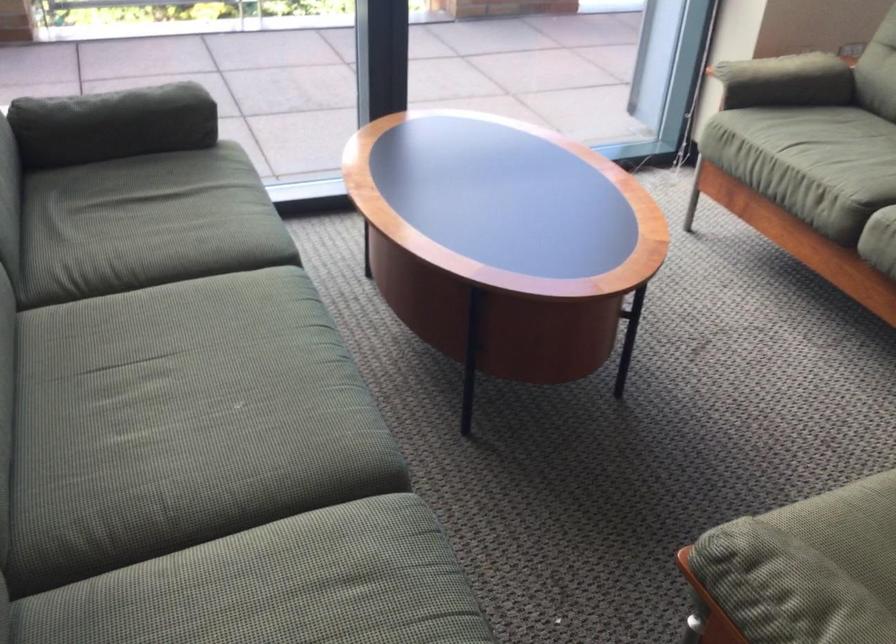
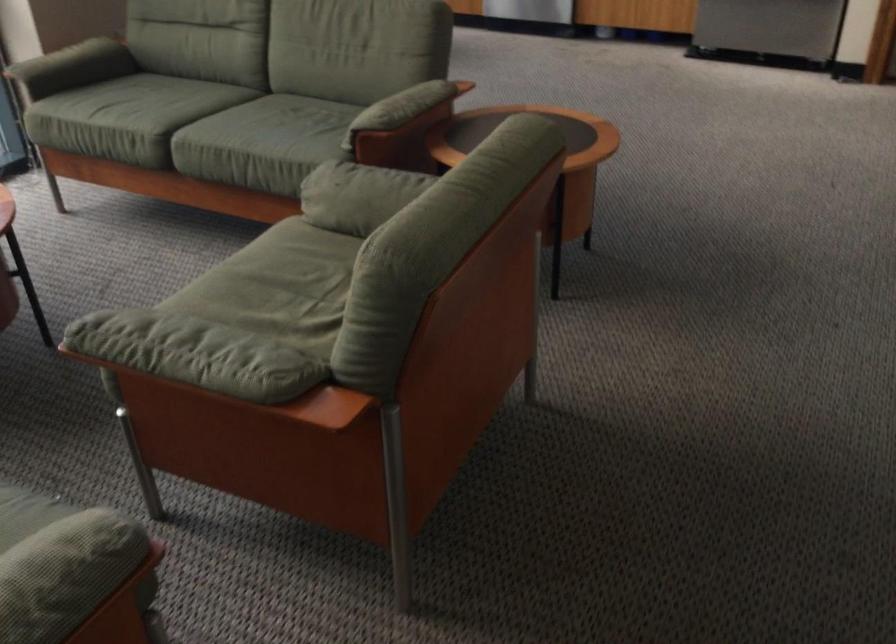
Question: The camera is either moving clockwise (left) or counter-clockwise (right) around the object. The first image is from the beginning of the video and the second image is from the end. Is the camera moving left or right when shooting the video?

Choices:
 (A) Left
 (B) Right

Answer: (A)